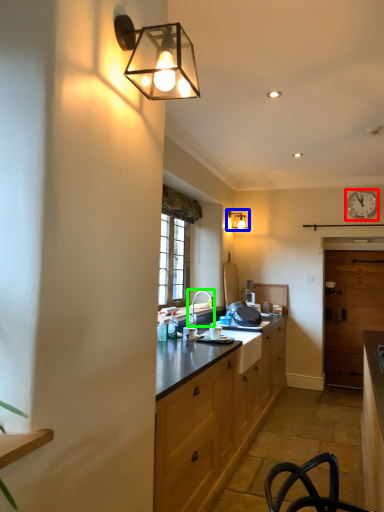
Question: Which is nearer to the clock (highlighted by a red box)? lamp (highlighted by a blue box) or tap (highlighted by a green box).

Choices:
 (A) lamp
 (B) tap

Answer: (A)